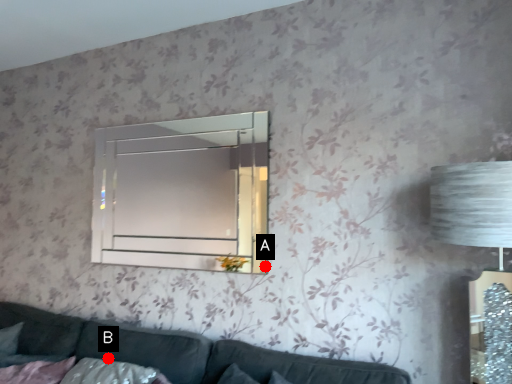
Question: Two points are circled on the image, labeled by A and B beside each circle. Among these points, which one is nearest to the camera?

Choices:
 (A) A is closer
 (B) B is closer

Answer: (B)